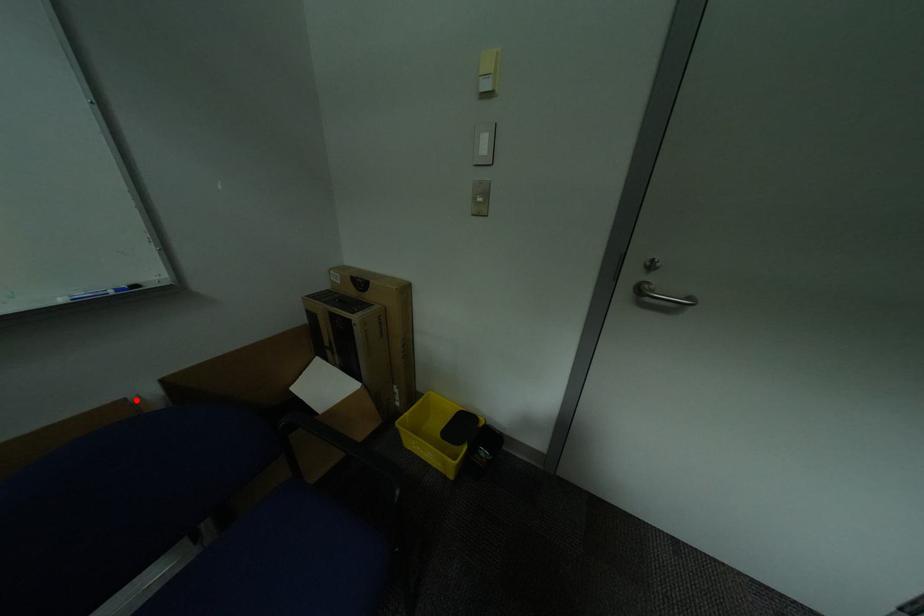
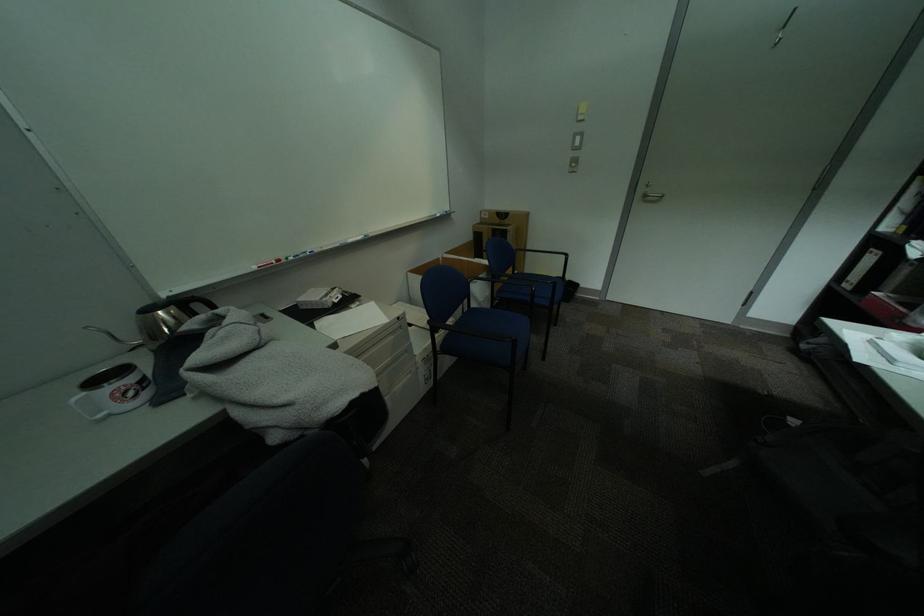
Locate, in the second image, the point that corresponds to the highlighted location in the first image.

(450, 259)